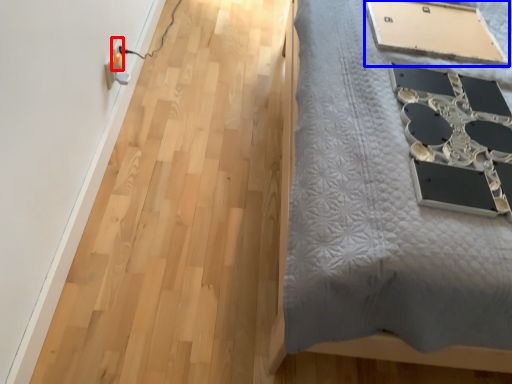
Question: Which of the following is the closest to the observer, electric outlet (highlighted by a red box) or table (highlighted by a blue box)?

Choices:
 (A) electric outlet
 (B) table

Answer: (B)